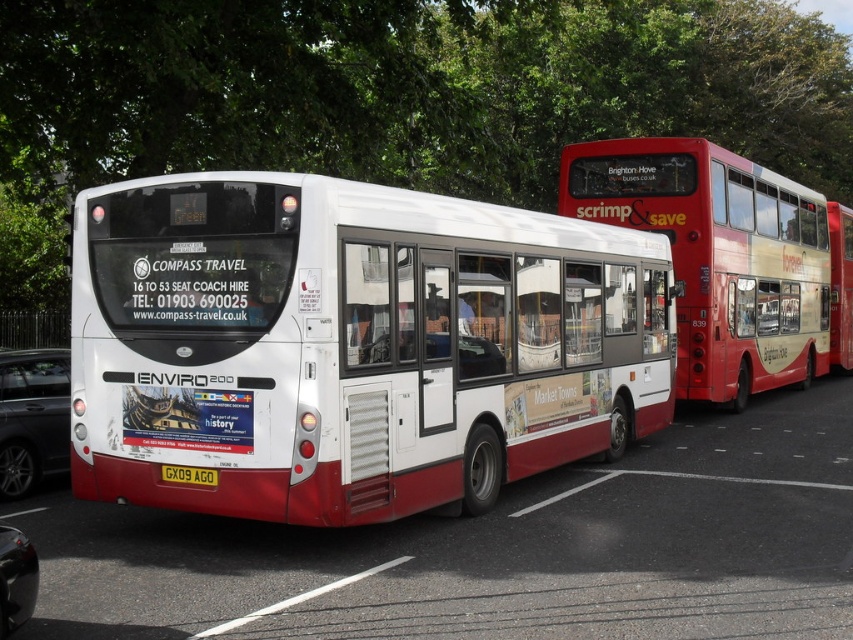
Between point (741, 243) and point (691, 477), which one is positioned behind?

The point (741, 243) is more distant.

Which is below, red matte double-decker bus at right or black asphalt at lower center?

Positioned lower is black asphalt at lower center.

Which is behind, point (723, 296) or point (695, 476)?

The point (723, 296) is more distant.

Where is `red matte double-decker bus at right`? red matte double-decker bus at right is located at coordinates (718, 257).

Is white glossy bus at center thinner than shiny black car at lower left?

No.

You are a GUI agent. You are given a task and a screenshot of the screen. Output one action in this format:
    pyautogui.click(x=<x>, y=<y>)
    Task: Click on the white glossy bus at center
    This screenshot has height=640, width=853.
    Given the screenshot: What is the action you would take?
    pyautogui.click(x=496, y=552)

Based on the photo, who is more forward, (358, 618) or (0, 577)?

Point (0, 577)

I want to click on white glossy bus at center, so click(x=496, y=552).

Is point (397, 248) more distant than point (286, 602)?

Yes, point (397, 248) is farther from viewer.

Is point (631, 308) positioned before point (393, 564)?

No, (631, 308) is behind (393, 564).

Does point (254, 436) lie behind point (309, 595)?

That is True.

Where is `white matte bus at center`? This screenshot has width=853, height=640. white matte bus at center is located at coordinates (351, 344).